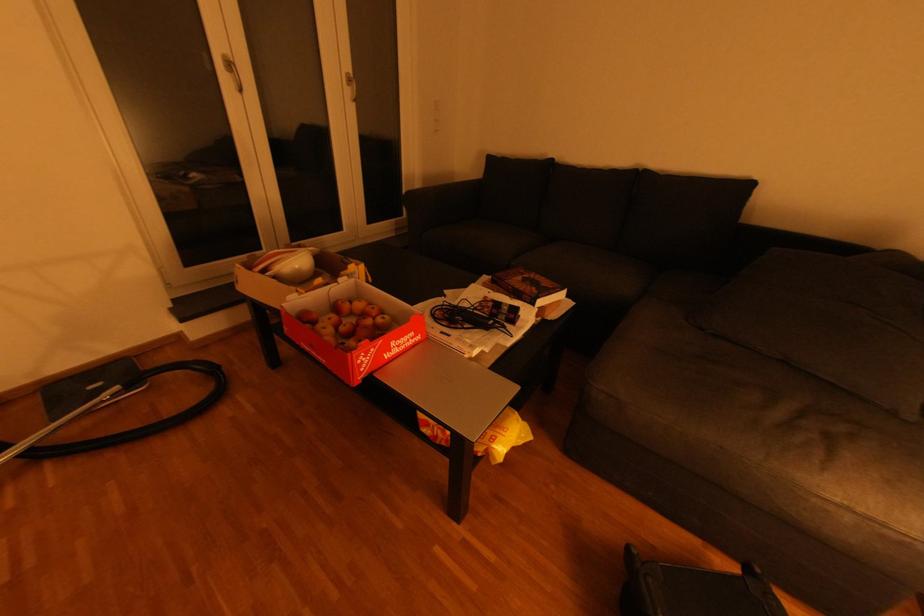
This screenshot has width=924, height=616. I want to click on red apple, so click(x=346, y=315).